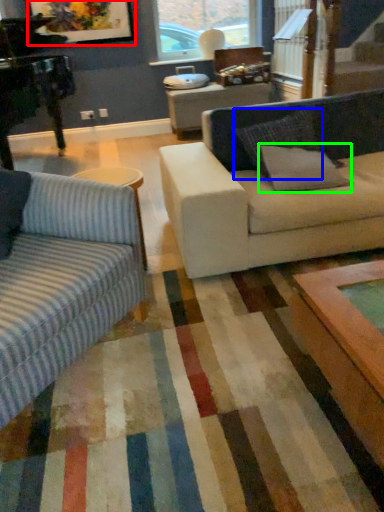
Question: Which object is positioned closest to picture frame (highlighted by a red box)? Select from pillow (highlighted by a blue box) and pillow (highlighted by a green box).

Choices:
 (A) pillow
 (B) pillow

Answer: (A)